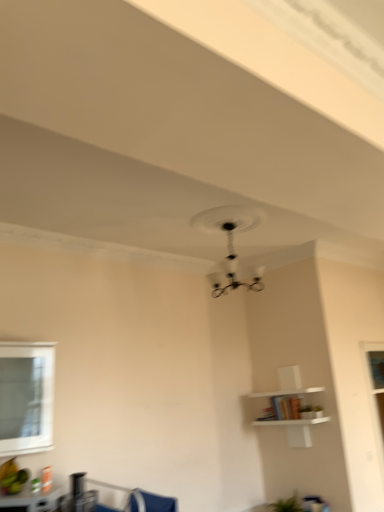
Describe the element at coordinates (230, 244) in the screenshot. The image size is (384, 512). I see `black matte fan at upper center` at that location.

What do you see at coordinates (150, 502) in the screenshot? I see `blue fabric swivel chair at lower center` at bounding box center [150, 502].

Describe the element at coordinates (26, 397) in the screenshot. I see `clear glass window at lower left` at that location.

Locate an element on the screen. The image size is (384, 512). matte black table at lower left is located at coordinates (33, 499).

You are a GUI agent. You are given a task and a screenshot of the screen. Output one action in this format:
    pyautogui.click(x=<x>, y=<y>)
    Task: Click on the black matte fan at upper center
    The height and width of the screenshot is (512, 384).
    Given the screenshot: What is the action you would take?
    pyautogui.click(x=230, y=244)

From the picture: Is blue fabric swivel chair at lower center taller than white matte shelf at upper right?

Incorrect, the height of blue fabric swivel chair at lower center is not larger of that of white matte shelf at upper right.

Is blue fabric swivel chair at lower center at the left side of white matte shelf at upper right?

Indeed, blue fabric swivel chair at lower center is positioned on the left side of white matte shelf at upper right.

From the image's perspective, which is below, blue fabric swivel chair at lower center or white matte shelf at upper right?

From the image's view, blue fabric swivel chair at lower center is below.

Between white matte shelf at upper right and clear glass window at lower left, which one is positioned in front?

clear glass window at lower left is closer to the camera.

Consider the image. Is white matte shelf at upper right not inside clear glass window at lower left?

Absolutely, white matte shelf at upper right is external to clear glass window at lower left.

From the image's perspective, is white matte shelf at upper right on top of clear glass window at lower left?

Actually, white matte shelf at upper right appears below clear glass window at lower left in the image.

Is black matte fan at upper center further to camera compared to matte black table at lower left?

Yes, it is.

This screenshot has height=512, width=384. I want to click on fan above the matte black table at lower left (from a real-world perspective), so click(x=230, y=244).

Considering the sizes of black matte fan at upper center and matte black table at lower left in the image, is black matte fan at upper center wider or thinner than matte black table at lower left?

Considering their sizes, black matte fan at upper center looks broader than matte black table at lower left.

Do you think black matte fan at upper center is within matte black table at lower left, or outside of it?

black matte fan at upper center lies outside matte black table at lower left.

Between clear glass window at lower left and black matte fan at upper center, which one appears on the left side from the viewer's perspective?

clear glass window at lower left.

Are clear glass window at lower left and black matte fan at upper center located far from each other?

clear glass window at lower left is far away from black matte fan at upper center.

Between clear glass window at lower left and black matte fan at upper center, which one has larger size?

black matte fan at upper center is bigger.

Is point (33, 410) positioned in front of point (226, 287)?

That is True.

I want to click on swivel chair on the left of the black matte fan at upper center, so click(x=150, y=502).

Is point (130, 510) closer or farther from the camera than point (212, 281)?

Point (130, 510).

Considering the relative positions of blue fabric swivel chair at lower center and black matte fan at upper center in the image provided, is blue fabric swivel chair at lower center to the left of black matte fan at upper center from the viewer's perspective?

Correct, you'll find blue fabric swivel chair at lower center to the left of black matte fan at upper center.

From a real-world perspective, is blue fabric swivel chair at lower center located higher than black matte fan at upper center?

Actually, blue fabric swivel chair at lower center is physically below black matte fan at upper center in the real world.

Consider the image. How many degrees apart are the facing directions of matte black table at lower left and white matte shelf at upper right?

47.8 degrees separate the facing orientations of matte black table at lower left and white matte shelf at upper right.

Is point (1, 503) closer or farther from the camera than point (292, 426)?

Point (1, 503) is positioned closer to the camera compared to point (292, 426).

Where is `table below the white matte shelf at upper right (from a real-world perspective)`? table below the white matte shelf at upper right (from a real-world perspective) is located at coordinates (33, 499).

From the picture: Is matte black table at lower left positioned beyond the bounds of white matte shelf at upper right?

That's correct, matte black table at lower left is outside of white matte shelf at upper right.

Who is smaller, blue fabric swivel chair at lower center or clear glass window at lower left?

blue fabric swivel chair at lower center.

Is blue fabric swivel chair at lower center oriented away from clear glass window at lower left?

No, blue fabric swivel chair at lower center is not facing away from clear glass window at lower left.

Who is shorter, blue fabric swivel chair at lower center or clear glass window at lower left?

Standing shorter between the two is blue fabric swivel chair at lower center.

Locate an element on the screen. The image size is (384, 512). shelf behind the blue fabric swivel chair at lower center is located at coordinates (292, 414).

The image size is (384, 512). Identify the location of shelf below the clear glass window at lower left (from a real-world perspective). (292, 414).

From the picture: Estimate the real-world distances between objects in this image. Which object is closer to blue fabric swivel chair at lower center, black matte fan at upper center or white matte shelf at upper right?

Based on the image, white matte shelf at upper right appears to be nearer to blue fabric swivel chair at lower center.

Looking at the image, which one is located further to black matte fan at upper center, blue fabric swivel chair at lower center or white matte shelf at upper right?

The object further to black matte fan at upper center is blue fabric swivel chair at lower center.

In the scene shown: Looking at the image, which one is located further to white matte shelf at upper right, black matte fan at upper center or clear glass window at lower left?

clear glass window at lower left lies further to white matte shelf at upper right than the other object.

Estimate the real-world distances between objects in this image. Which object is further from white matte shelf at upper right, black matte fan at upper center or matte black table at lower left?

Among the two, matte black table at lower left is located further to white matte shelf at upper right.

Which object lies nearer to the anchor point blue fabric swivel chair at lower center, black matte fan at upper center or matte black table at lower left?

matte black table at lower left.

Estimate the real-world distances between objects in this image. Which object is closer to black matte fan at upper center, white matte shelf at upper right or matte black table at lower left?

white matte shelf at upper right is positioned closer to the anchor black matte fan at upper center.

Estimate the real-world distances between objects in this image. Which object is further from matte black table at lower left, white matte shelf at upper right or black matte fan at upper center?

black matte fan at upper center.

From the image, which object appears to be nearer to matte black table at lower left, black matte fan at upper center or clear glass window at lower left?

Based on the image, clear glass window at lower left appears to be nearer to matte black table at lower left.

Identify the location of shelf between black matte fan at upper center and blue fabric swivel chair at lower center in the vertical direction. (292, 414).

Image resolution: width=384 pixels, height=512 pixels. I want to click on fan between matte black table at lower left and white matte shelf at upper right, so tap(230, 244).

Where is `window between black matte fan at upper center and blue fabric swivel chair at lower center in the vertical direction`? Image resolution: width=384 pixels, height=512 pixels. window between black matte fan at upper center and blue fabric swivel chair at lower center in the vertical direction is located at coordinates (26, 397).

The image size is (384, 512). Find the location of `swivel chair between clear glass window at lower left and white matte shelf at upper right in the horizontal direction`. swivel chair between clear glass window at lower left and white matte shelf at upper right in the horizontal direction is located at coordinates (150, 502).